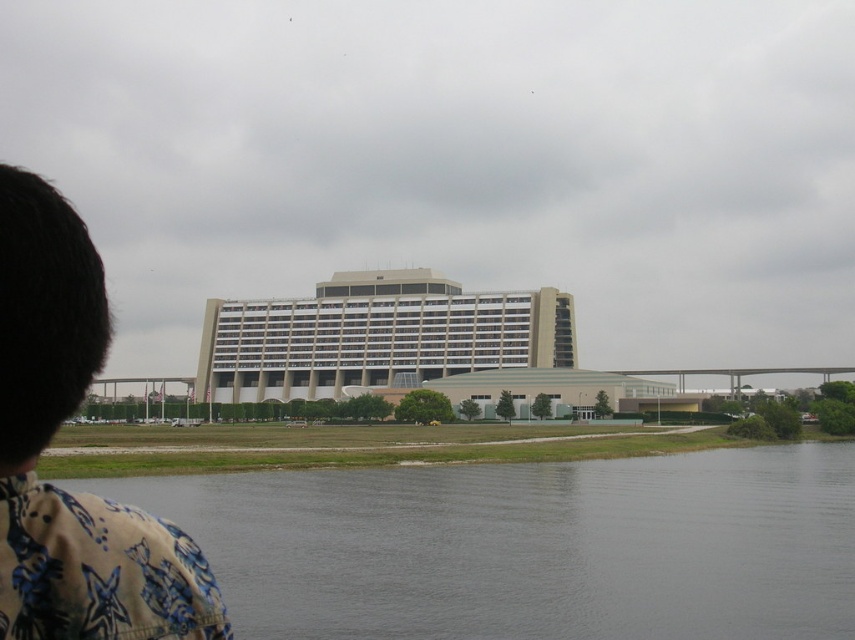
You are a photographer trying to capture the beige concrete building at center and the gray smooth water at lower center in a single shot. Based on their sizes, which object should you focus on first to ensure both are clearly visible in your photo?

Since the gray smooth water at lower center is smaller in size compared to the beige concrete building at center, you should focus on the beige concrete building at center first to ensure it is sharp and in focus, as it occupies more of the frame.